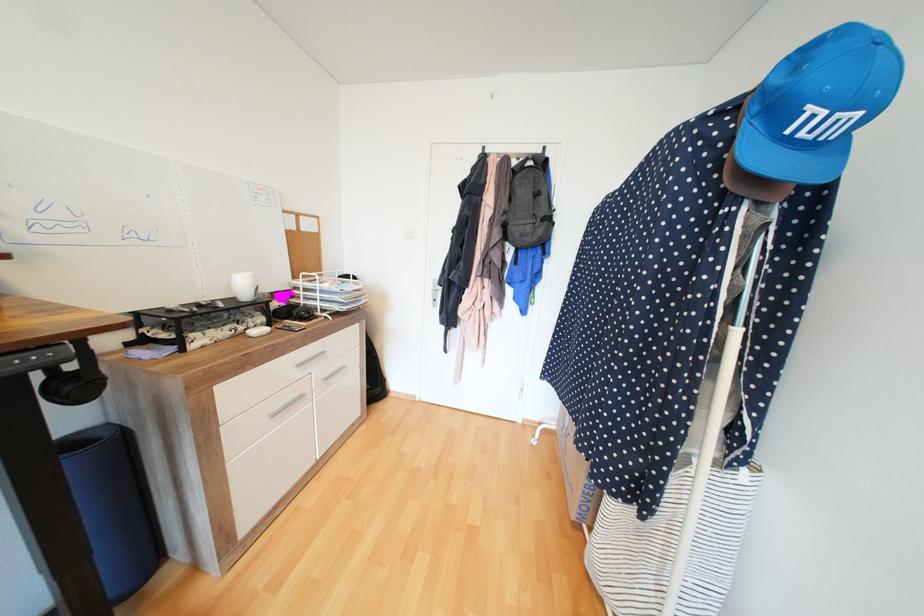
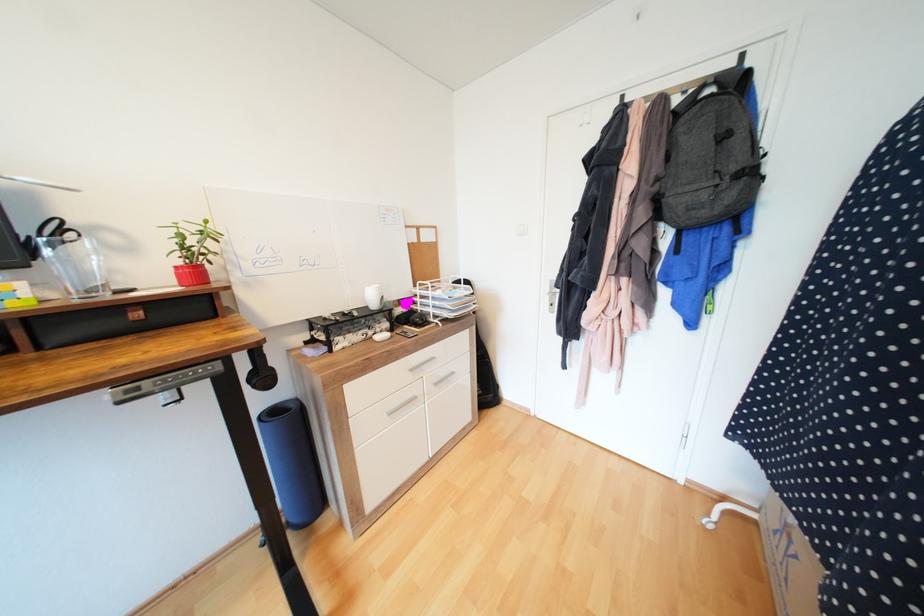
Question: In a continuous first-person perspective shot, in which direction is the camera moving?

Choices:
 (A) Left
 (B) Right
 (C) Forward
 (D) Backward

Answer: (C)